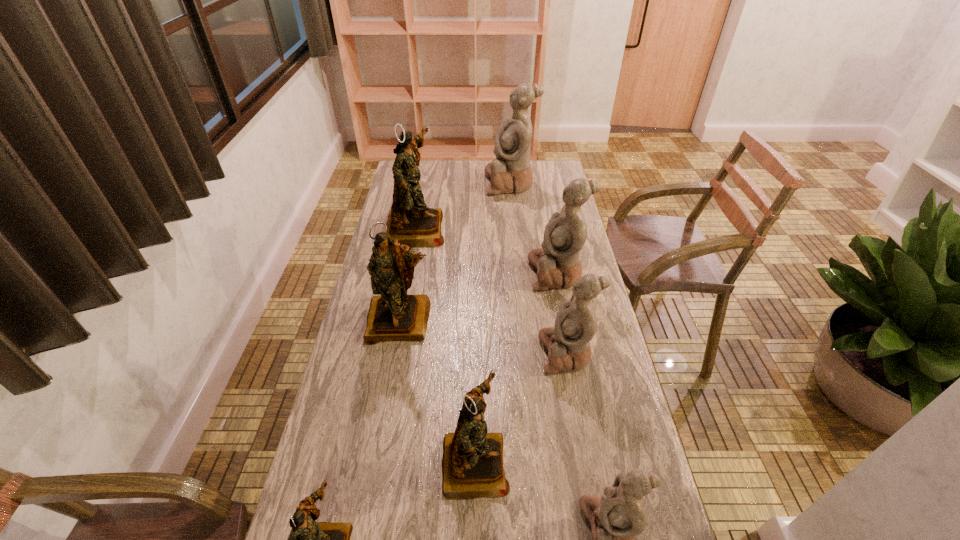
This screenshot has width=960, height=540. In order to click on free space located on the front-facing side of the third biggest white figurine in this screenshot , I will do `click(416, 353)`.

Where is `free location located on the front-facing side of the third biggest white figurine`? free location located on the front-facing side of the third biggest white figurine is located at coordinates (449, 353).

The image size is (960, 540). Find the location of `object positioned at the far edge`. object positioned at the far edge is located at coordinates (511, 171).

Where is `object that is at the far right corner`? This screenshot has height=540, width=960. object that is at the far right corner is located at coordinates (511, 171).

In the image, there is a desktop. Identify the location of vacant space at the left edge. (376, 414).

You are a GUI agent. You are given a task and a screenshot of the screen. Output one action in this format:
    pyautogui.click(x=<x>, y=<y>)
    Task: Click on the blank space at the right edge
    
    Given the screenshot: What is the action you would take?
    pyautogui.click(x=546, y=193)

In the image, there is a desktop. Find the location of `vacant area at the far right corner`. vacant area at the far right corner is located at coordinates (533, 164).

At what (x,y) coordinates should I click in order to perform the action: click on free space between the sixth nearest object and the second farthest gold figurine. Please return your answer as a coordinate pair (x, y). This screenshot has height=540, width=960. Looking at the image, I should click on (479, 297).

Find the location of a particular element. This screenshot has width=960, height=540. vacant area that lies between the sixth nearest figurine and the second farthest figurine is located at coordinates (486, 251).

Locate an element on the screen. free space between the second smallest gold figurine and the third nearest gold figurine is located at coordinates (438, 391).